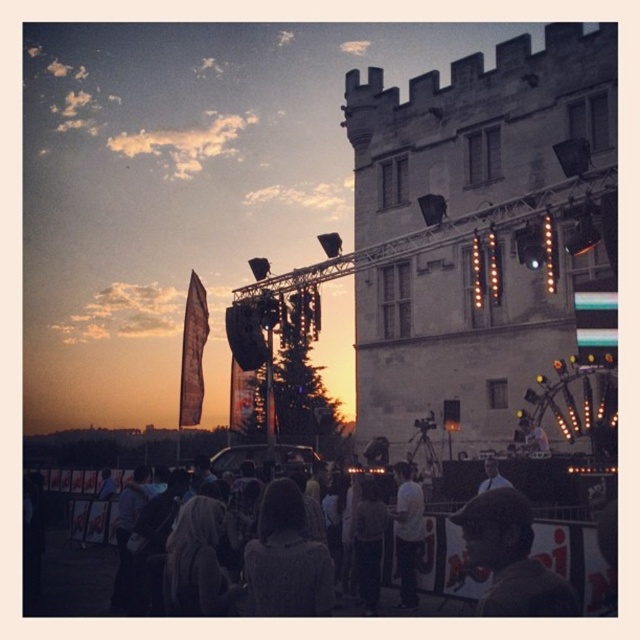
You are a photographer trying to capture a photo of the light brown hair at center without including the dark brown leather jacket at lower right. Based on their positions, is this possible?

The dark brown leather jacket at lower right might be wider than light brown hair at center, so there is a possibility that the jacket could block the view of the hair depending on the angle and distance. To ensure the hair is visible without the jacket, the photographer should position themselves or adjust the camera angle to avoid the jacket obstructing the shot.

You are a photographer trying to capture a group photo of the knitted gray sweater at center and the white cotton shirt at center. The camera lens has a maximum width capacity of 1.2 meters. Based on their positions, can both items fit within the camera frame without any adjustments?

The knitted gray sweater at center might be wider than the white cotton shirt at center, but since the exact width isn t specified, it s uncertain if they can fit within the 1.2 meters. Further measurement is needed to confirm.

You are standing at the point marked by the coordinates point (509, 557). Which object are you standing on?

You are standing on the dark brown leather jacket at lower right.